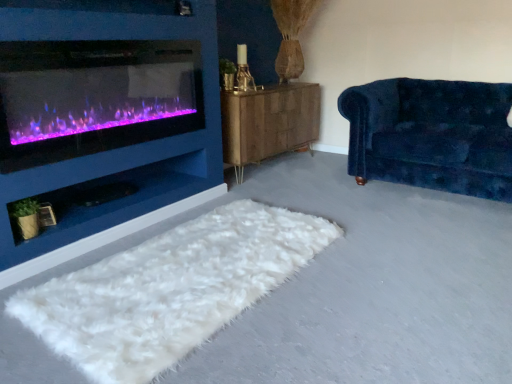
Question: Can you confirm if velvet blue couch at right is bigger than white fluffy rug at lower center?

Choices:
 (A) no
 (B) yes

Answer: (B)

Question: Is velvet blue couch at right to the left of white fluffy rug at lower center from the viewer's perspective?

Choices:
 (A) no
 (B) yes

Answer: (A)

Question: Does velvet blue couch at right appear on the right side of white fluffy rug at lower center?

Choices:
 (A) yes
 (B) no

Answer: (A)

Question: Can you confirm if velvet blue couch at right is smaller than white fluffy rug at lower center?

Choices:
 (A) no
 (B) yes

Answer: (A)

Question: Is velvet blue couch at right not within white fluffy rug at lower center?

Choices:
 (A) no
 (B) yes

Answer: (B)

Question: Based on their sizes in the image, would you say velvet blue couch at right is bigger or smaller than purple glass wood burning stove at left?

Choices:
 (A) small
 (B) big

Answer: (B)

Question: Considering the positions of point (463, 170) and point (44, 102), is point (463, 170) closer or farther from the camera than point (44, 102)?

Choices:
 (A) closer
 (B) farther

Answer: (B)

Question: Relative to purple glass wood burning stove at left, is velvet blue couch at right in front or behind?

Choices:
 (A) front
 (B) behind

Answer: (B)

Question: From a real-world perspective, is velvet blue couch at right physically located above or below purple glass wood burning stove at left?

Choices:
 (A) below
 (B) above

Answer: (A)

Question: Is white fluffy rug at lower center taller or shorter than velvet blue couch at right?

Choices:
 (A) tall
 (B) short

Answer: (B)

Question: From a real-world perspective, is white fluffy rug at lower center above or below velvet blue couch at right?

Choices:
 (A) above
 (B) below

Answer: (B)

Question: Based on their positions, is white fluffy rug at lower center located to the left or right of velvet blue couch at right?

Choices:
 (A) right
 (B) left

Answer: (B)

Question: Is white fluffy rug at lower center wider or thinner than velvet blue couch at right?

Choices:
 (A) thin
 (B) wide

Answer: (A)

Question: From a real-world perspective, is purple glass wood burning stove at left above or below woodenmaterial/texturedresser at center?

Choices:
 (A) above
 (B) below

Answer: (A)

Question: Looking at their shapes, would you say purple glass wood burning stove at left is wider or thinner than woodenmaterial/texturedresser at center?

Choices:
 (A) thin
 (B) wide

Answer: (A)